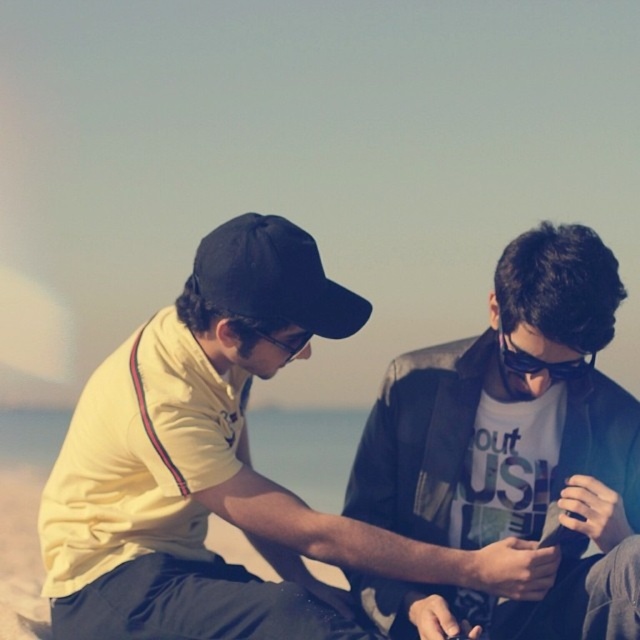
Question: Is matte black shirt at center bigger than black matte goggles at center?

Choices:
 (A) no
 (B) yes

Answer: (B)

Question: Is black matte baseball cap at center to the right of black matte goggles at center from the viewer's perspective?

Choices:
 (A) no
 (B) yes

Answer: (A)

Question: Is matte black shirt at center positioned behind black matte baseball cap at center?

Choices:
 (A) yes
 (B) no

Answer: (B)

Question: Based on their relative distances, which object is farther from the matte black shirt at center?

Choices:
 (A) black matte baseball cap at center
 (B) black matte goggles at center
 (C) yellow fabric shirt at center

Answer: (A)

Question: Which point is farther to the camera?

Choices:
 (A) (353, 320)
 (B) (602, 477)

Answer: (A)

Question: Considering the real-world distances, which object is farthest from the black matte goggles at center?

Choices:
 (A) matte black shirt at center
 (B) black matte baseball cap at center

Answer: (B)